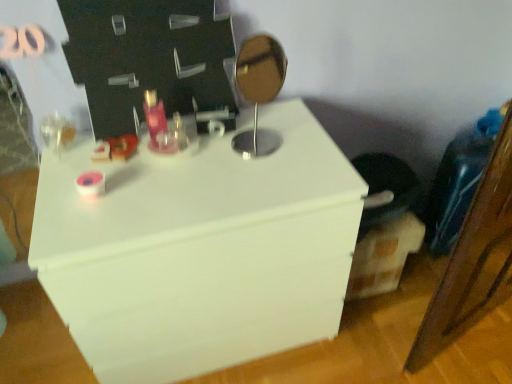
Question: Considering the relative sizes of matte pink glass at center and metallic silver mirror at center in the image provided, is matte pink glass at center taller than metallic silver mirror at center?

Choices:
 (A) no
 (B) yes

Answer: (A)

Question: Is matte pink glass at center to the right of metallic silver mirror at center from the viewer's perspective?

Choices:
 (A) yes
 (B) no

Answer: (B)

Question: From a real-world perspective, is matte pink glass at center physically below metallic silver mirror at center?

Choices:
 (A) yes
 (B) no

Answer: (A)

Question: From a real-world perspective, is matte pink glass at center positioned over metallic silver mirror at center based on gravity?

Choices:
 (A) yes
 (B) no

Answer: (B)

Question: Is matte pink glass at center smaller than metallic silver mirror at center?

Choices:
 (A) no
 (B) yes

Answer: (B)

Question: Is matte pink glass at center in front of metallic silver mirror at center?

Choices:
 (A) no
 (B) yes

Answer: (A)

Question: Is metallic silver mirror at center closer to camera compared to matte pink glass at center?

Choices:
 (A) no
 (B) yes

Answer: (B)

Question: Is metallic silver mirror at center next to matte pink glass at center?

Choices:
 (A) yes
 (B) no

Answer: (B)

Question: From a real-world perspective, is metallic silver mirror at center on top of matte pink glass at center?

Choices:
 (A) no
 (B) yes

Answer: (B)

Question: From a real-world perspective, is metallic silver mirror at center beneath matte pink glass at center?

Choices:
 (A) yes
 (B) no

Answer: (B)

Question: Is metallic silver mirror at center far from matte pink glass at center?

Choices:
 (A) no
 (B) yes

Answer: (A)

Question: Is metallic silver mirror at center thinner than matte pink glass at center?

Choices:
 (A) yes
 (B) no

Answer: (B)

Question: From the image's perspective, is matte pink glass at center located above white matte dresser at center?

Choices:
 (A) yes
 (B) no

Answer: (A)